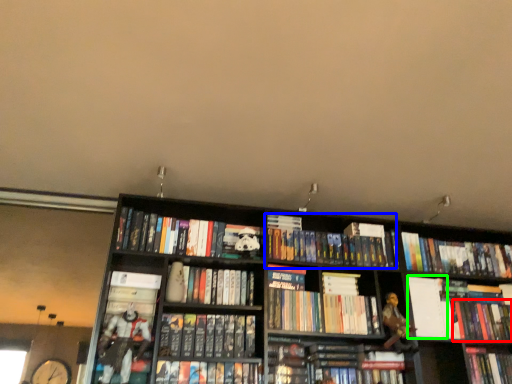
Question: Which object is positioned closest to book (highlighted by a red box)? Select from book (highlighted by a blue box) and paperback book (highlighted by a green box).

Choices:
 (A) book
 (B) paperback book

Answer: (B)